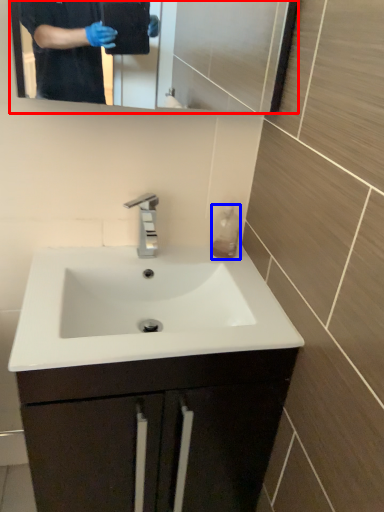
Question: Which object is closer to the camera taking this photo, mirror (highlighted by a red box) or liquid (highlighted by a blue box)?

Choices:
 (A) mirror
 (B) liquid

Answer: (A)